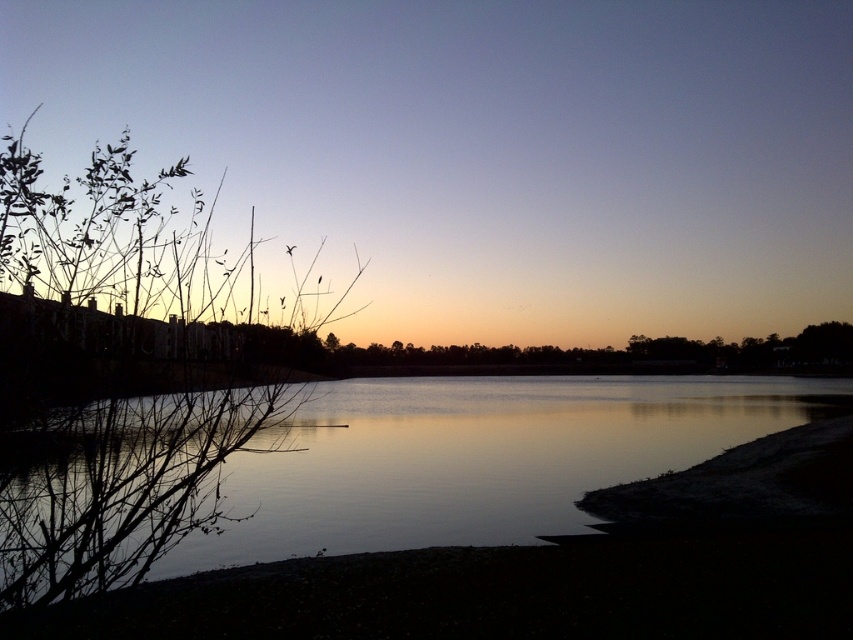
Question: Does green leafy branches at left have a greater width compared to silvery reflective water at center?

Choices:
 (A) yes
 (B) no

Answer: (B)

Question: Which point appears closest to the camera in this image?

Choices:
 (A) [419, 474]
 (B) [115, 563]

Answer: (B)

Question: Which object is farther from the camera taking this photo?

Choices:
 (A) green leafy branches at left
 (B) silvery reflective water at center

Answer: (B)

Question: Which point is closer to the camera taking this photo?

Choices:
 (A) (6, 378)
 (B) (538, 451)

Answer: (A)

Question: Is green leafy branches at left wider than silvery reflective water at center?

Choices:
 (A) no
 (B) yes

Answer: (A)

Question: Can you confirm if green leafy branches at left is bigger than silvery reflective water at center?

Choices:
 (A) yes
 (B) no

Answer: (A)